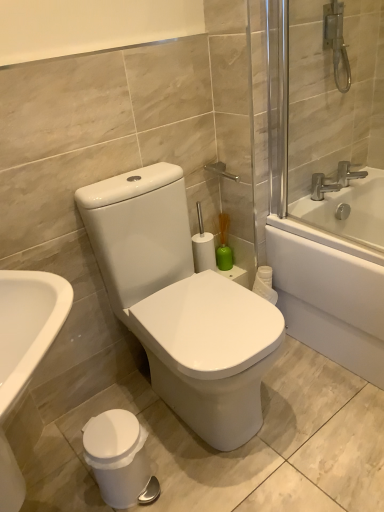
Image resolution: width=384 pixels, height=512 pixels. In order to click on spots to the right of white plastic trash can at lower left in this screenshot , I will do `click(184, 474)`.